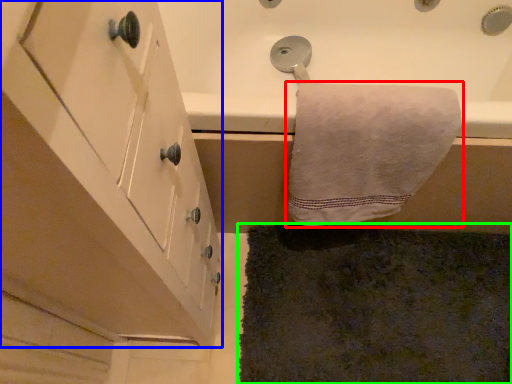
Question: Which object is positioned closest to towel (highlighted by a red box)? Select from cabinetry (highlighted by a blue box) and bath mat (highlighted by a green box).

Choices:
 (A) cabinetry
 (B) bath mat

Answer: (A)